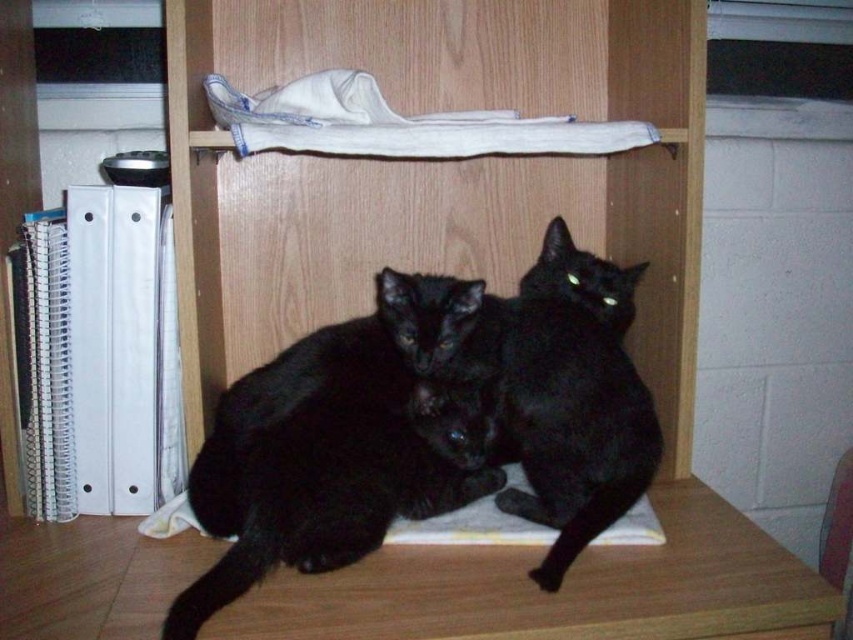
Question: Does wooden bookshelf at center lie behind black matte fur cat at center?

Choices:
 (A) yes
 (B) no

Answer: (A)

Question: Among these points, which one is nearest to the camera?

Choices:
 (A) click(479, 400)
 (B) click(38, 596)
 (C) click(602, 380)

Answer: (B)

Question: Among these points, which one is nearest to the camera?

Choices:
 (A) (508, 625)
 (B) (531, 307)
 (C) (312, 323)

Answer: (A)

Question: Which is nearer to the black matte fur cat at center?

Choices:
 (A) wooden bookshelf at center
 (B) wooden table at lower center

Answer: (B)

Question: Is wooden bookshelf at center below black fur cat at center?

Choices:
 (A) no
 (B) yes

Answer: (A)

Question: Is wooden bookshelf at center smaller than black matte fur cat at center?

Choices:
 (A) no
 (B) yes

Answer: (A)